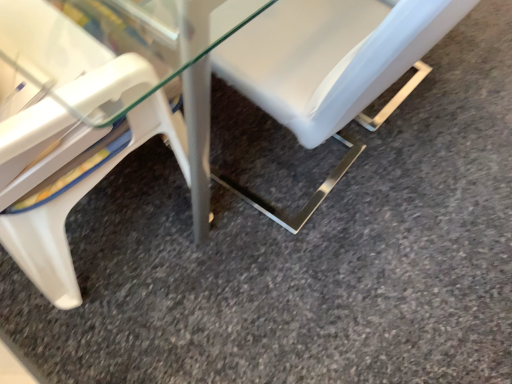
Question: From the image's perspective, is white plastic chair at lower left, which is the 1th chair from left to right, above or below white plastic chair at center, the 2th chair viewed from the left?

Choices:
 (A) below
 (B) above

Answer: (A)

Question: Is point (10, 89) positioned closer to the camera than point (409, 89)?

Choices:
 (A) farther
 (B) closer

Answer: (B)

Question: Is white plastic chair at lower left, which is the 1th chair from left to right, in front of or behind white plastic chair at center, the 2th chair viewed from the left, in the image?

Choices:
 (A) front
 (B) behind

Answer: (A)

Question: Looking at their shapes, would you say white plastic chair at center, which is the first chair in right-to-left order, is wider or thinner than white plastic chair at lower left, which is the 1th chair from left to right?

Choices:
 (A) thin
 (B) wide

Answer: (B)

Question: Is white plastic chair at center, which is the first chair in right-to-left order, bigger or smaller than white plastic chair at lower left, the 2th chair in the right-to-left sequence?

Choices:
 (A) big
 (B) small

Answer: (B)

Question: From a real-world perspective, is white plastic chair at center, the 2th chair viewed from the left, positioned above or below white plastic chair at lower left, the 2th chair in the right-to-left sequence?

Choices:
 (A) below
 (B) above

Answer: (A)

Question: In the image, is white plastic chair at center, the 2th chair viewed from the left, on the left side or the right side of white plastic chair at lower left, the 2th chair in the right-to-left sequence?

Choices:
 (A) left
 (B) right

Answer: (B)